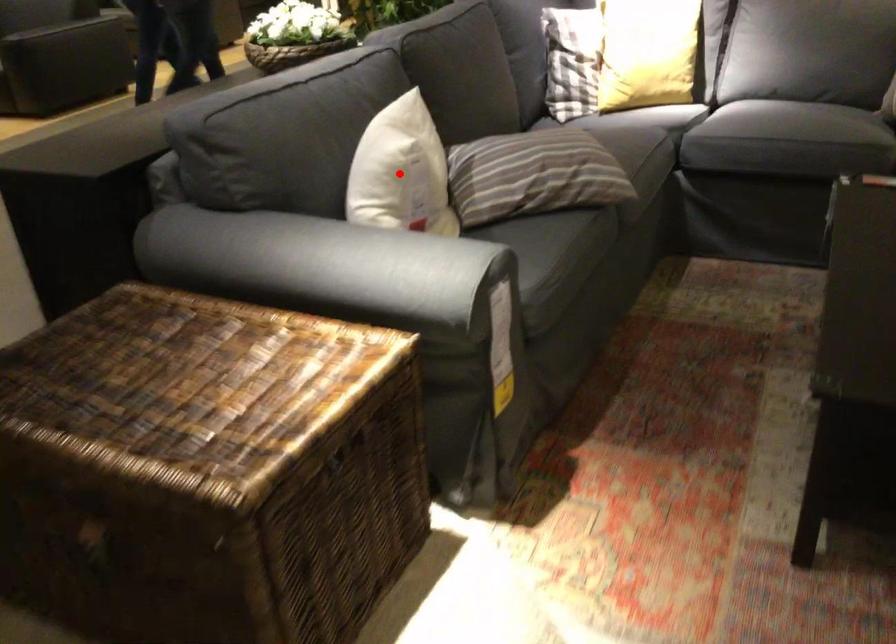
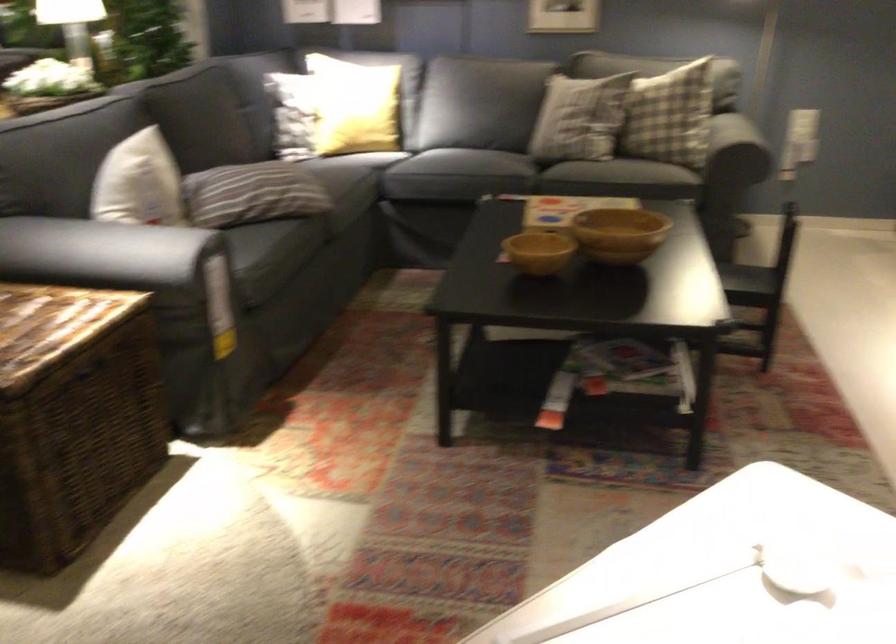
Question: I am providing you with two images of the same scene from different viewpoints. Given a red point in image1, look at the same physical point in image2. Is it:

Choices:
 (A) Closer to the viewpoint
 (B) Farther from the viewpoint

Answer: (B)